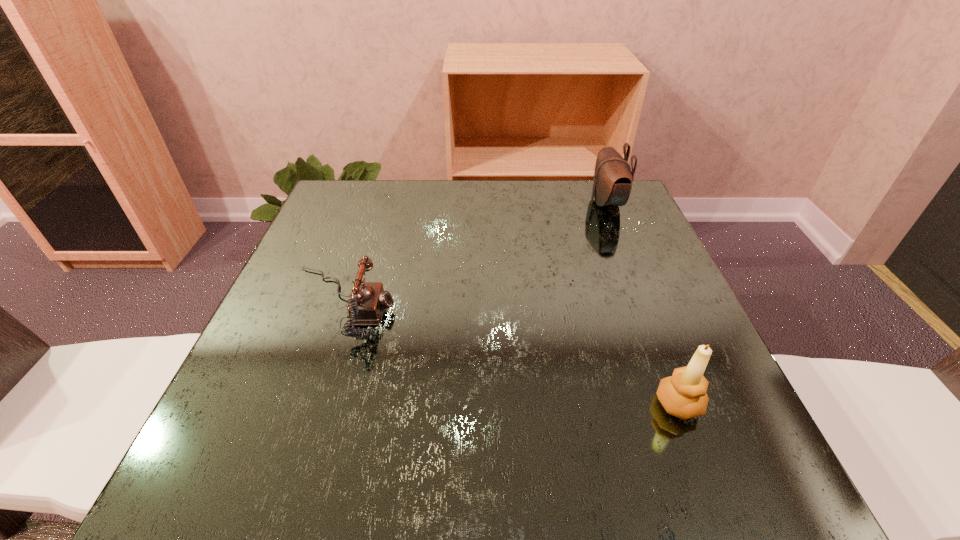
Where is `the farthest object`? Image resolution: width=960 pixels, height=540 pixels. the farthest object is located at coordinates (613, 178).

This screenshot has height=540, width=960. In order to click on the nearest object in this screenshot , I will do `click(683, 395)`.

The width and height of the screenshot is (960, 540). Find the location of `the second nearest object`. the second nearest object is located at coordinates (367, 302).

The width and height of the screenshot is (960, 540). Identify the location of the leftmost object. (367, 302).

What are the coordinates of `vacant space positioned with the flap open on the farthest object` in the screenshot? It's located at (484, 203).

Where is `vacant area situated 0.400m with the flap open on the farthest object`? The height and width of the screenshot is (540, 960). vacant area situated 0.400m with the flap open on the farthest object is located at coordinates (439, 203).

Identify the location of vacant area situated with the flap open on the farthest object. The height and width of the screenshot is (540, 960). (556, 203).

Find the location of `free spot located on the left of the candle_holder`. free spot located on the left of the candle_holder is located at coordinates (411, 404).

Where is `vacant space located 0.160m on the dial of the shortest object`? vacant space located 0.160m on the dial of the shortest object is located at coordinates coord(476,303).

This screenshot has width=960, height=540. Find the location of `object present at the far edge`. object present at the far edge is located at coordinates (613, 178).